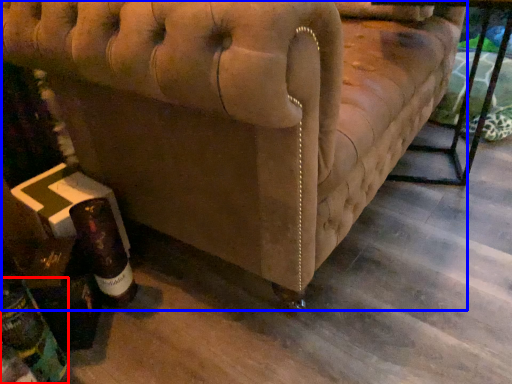
Question: Which object is closer to the camera taking this photo, bottle (highlighted by a red box) or furniture (highlighted by a blue box)?

Choices:
 (A) bottle
 (B) furniture

Answer: (B)